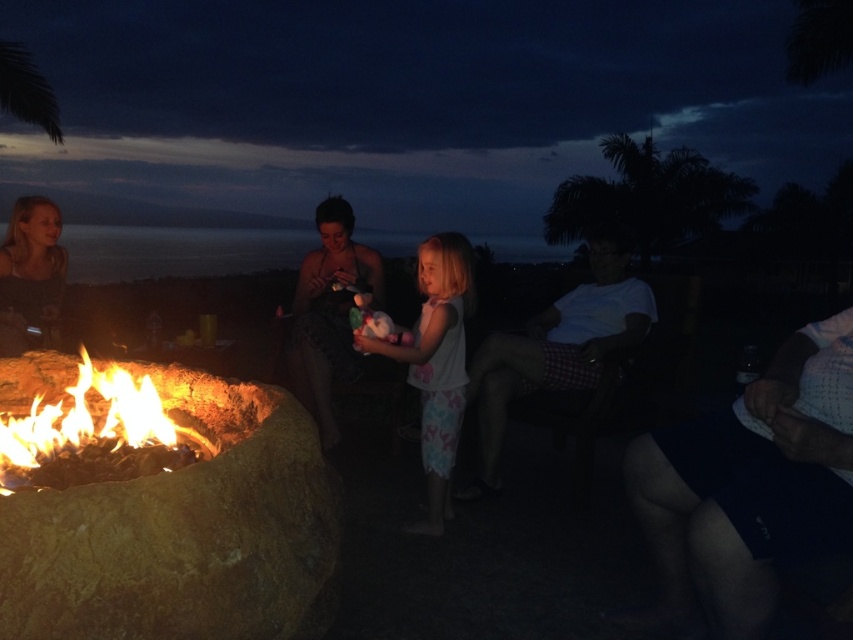
Which is below, rustic stone fire pit at lower left or flaming wood fire at lower left?

Positioned lower is rustic stone fire pit at lower left.

Does rustic stone fire pit at lower left have a smaller size compared to flaming wood fire at lower left?

No, rustic stone fire pit at lower left is not smaller than flaming wood fire at lower left.

Find the location of a particular element. This screenshot has width=853, height=640. rustic stone fire pit at lower left is located at coordinates (184, 532).

Is white cotton shirt at right positioned at the back of matte black dress at center?

No, it is not.

Measure the distance between white cotton shirt at right and matte black dress at center.

3.66 feet

Who is more distant from viewer, (x=514, y=365) or (x=308, y=280)?

Point (x=308, y=280)

The width and height of the screenshot is (853, 640). In order to click on white cotton shirt at right in this screenshot , I will do `click(558, 346)`.

You are a GUI agent. You are given a task and a screenshot of the screen. Output one action in this format:
    pyautogui.click(x=<x>, y=<y>)
    Task: Click on the flaming wood fire at lower left
    Image resolution: width=853 pixels, height=640 pixels.
    Given the screenshot: What is the action you would take?
    pyautogui.click(x=91, y=426)

Does flaming wood fire at lower left have a greater height compared to blonde hair at upper left?

Incorrect, flaming wood fire at lower left's height is not larger of blonde hair at upper left's.

Is point (22, 480) closer to viewer compared to point (39, 292)?

That is True.

What are the coordinates of `flaming wood fire at lower left` in the screenshot? It's located at (91, 426).